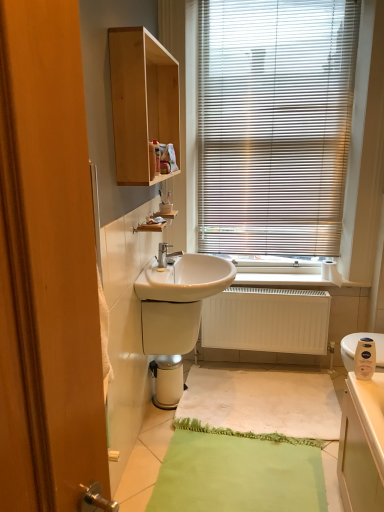
The width and height of the screenshot is (384, 512). What are the coordinates of `free space in front of silver metallic tap at center` in the screenshot? It's located at [x=162, y=280].